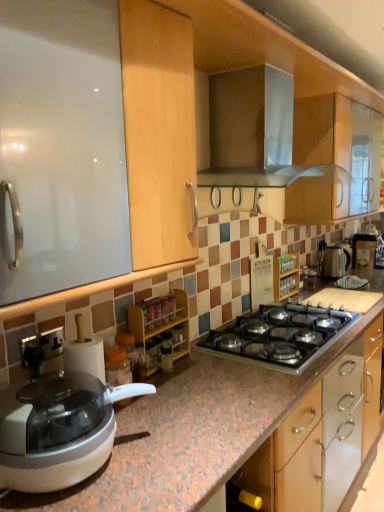
Locate an element on the screen. The height and width of the screenshot is (512, 384). blank space situated above wooden spice rack at center, which is the 1th cabinetry from front to back (from a real-world perspective) is located at coordinates (155, 297).